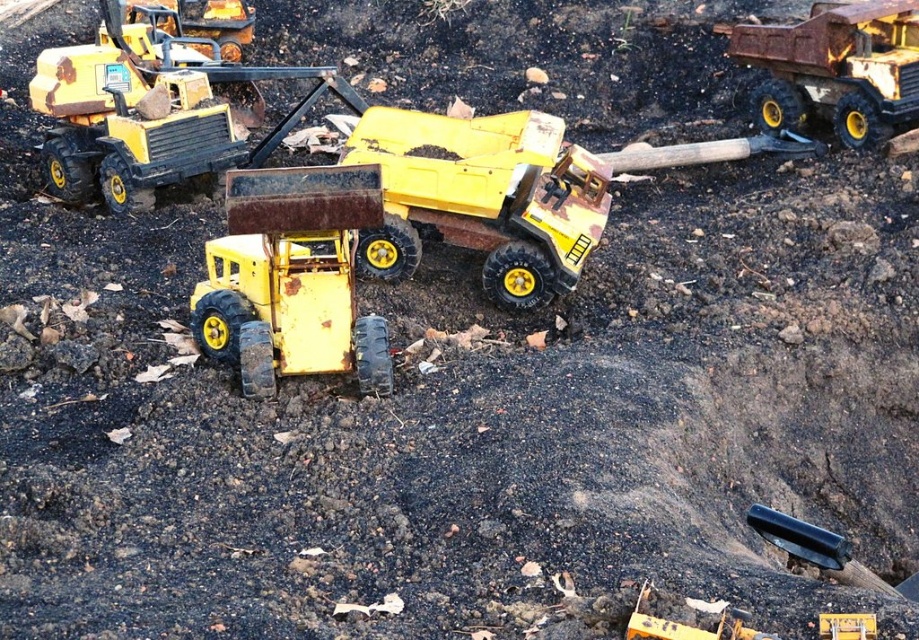
You are a child trying to fit both the matte yellow dump truck at center and the rusty yellow bulldozer at center into a toy box that can only hold items up to the width of the wider vehicle. Which vehicle should you measure to determine the toy box size?

The matte yellow dump truck at center is wider than the rusty yellow bulldozer at center, so you should measure the matte yellow dump truck at center to determine the toy box size.

You are a child trying to decide which toy vehicle to play with first. Both the matte yellow dump truck at center and the rusty yellow bulldozer at center are in front of you. Which one is bigger?

The matte yellow dump truck at center is larger in size compared to the rusty yellow bulldozer at center.

You are a child trying to stack the matte yellow dump truck at center and the rusty yellow bulldozer at center on top of each other. Which one should you place at the bottom to make the stack stable?

The matte yellow dump truck at center is taller than the rusty yellow bulldozer at center, so you should place the rusty yellow bulldozer at center at the bottom to make the stack stable.